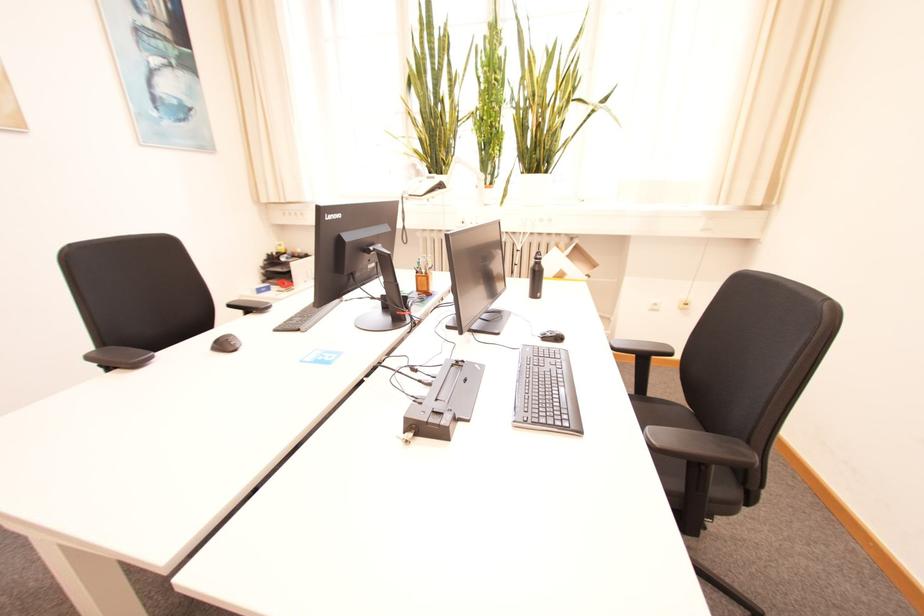
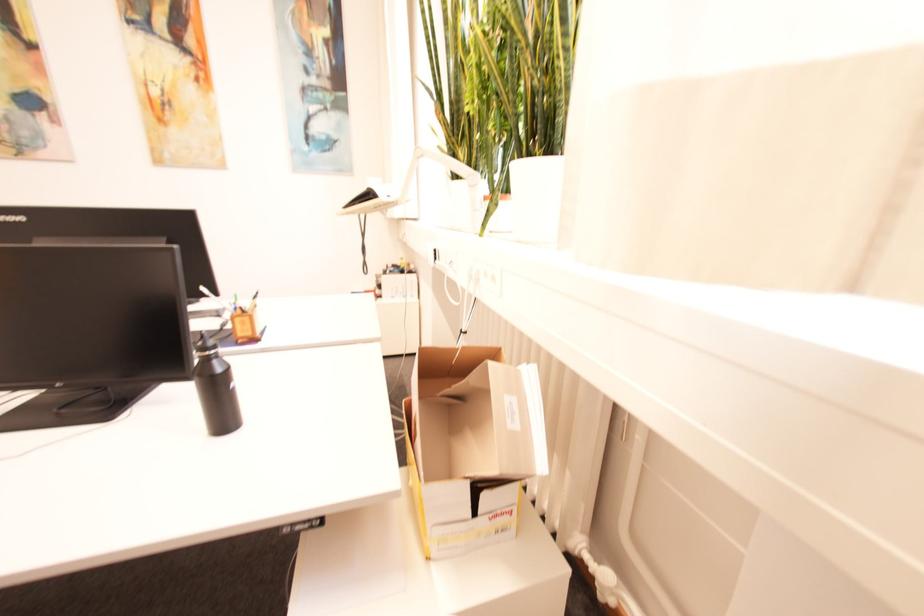
Question: I am providing you with two images of the same scene from different viewpoints. Please identify which objects are invisible in image2.

Choices:
 (A) wooden pen holder
 (B) stack of papers
 (C) open cardboard box
 (D) none of these

Answer: (D)